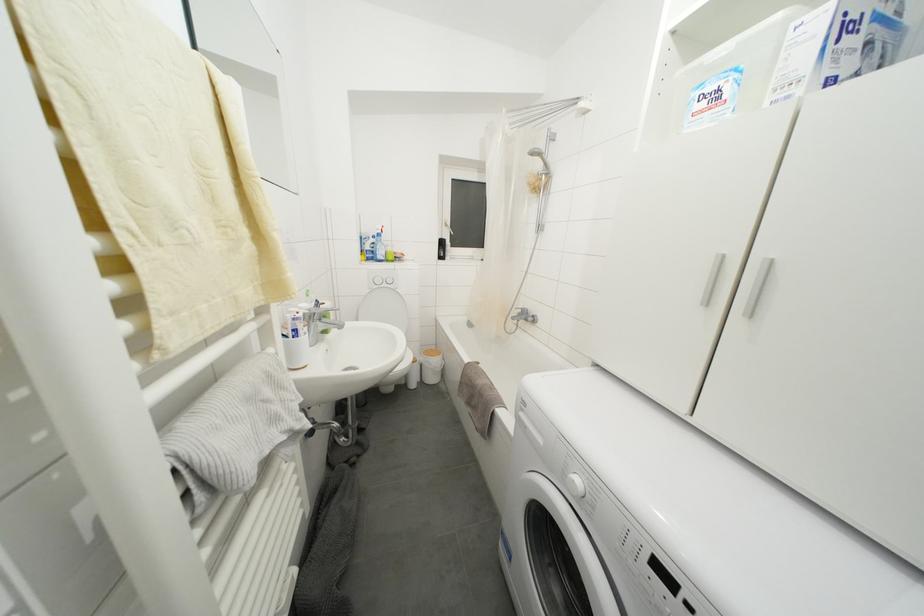
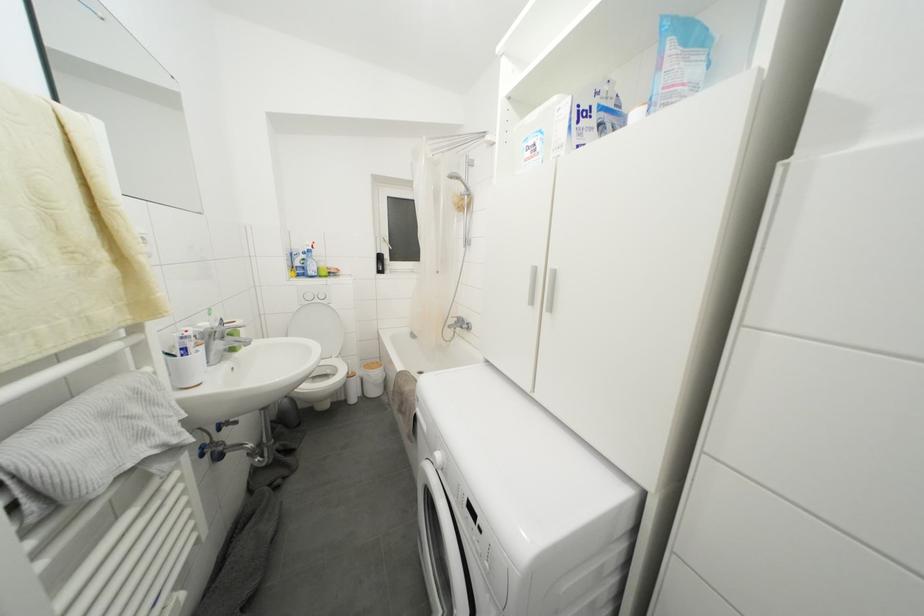
In the second image, find the point that corresponds to point (378, 248) in the first image.

(308, 264)